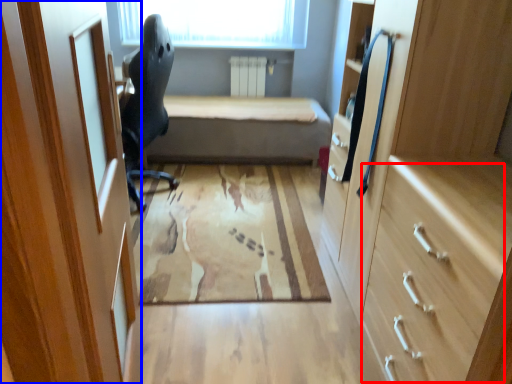
Question: Which of the following is the farthest to the observer, drawer (highlighted by a red box) or door (highlighted by a blue box)?

Choices:
 (A) drawer
 (B) door

Answer: (A)